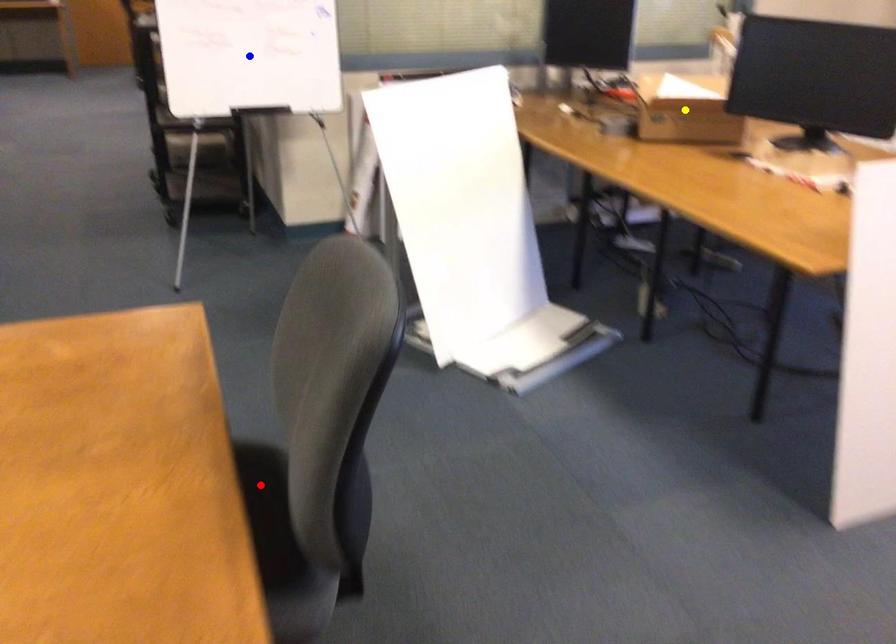
Order these from nearest to farthest:
yellow point
red point
blue point

1. blue point
2. yellow point
3. red point